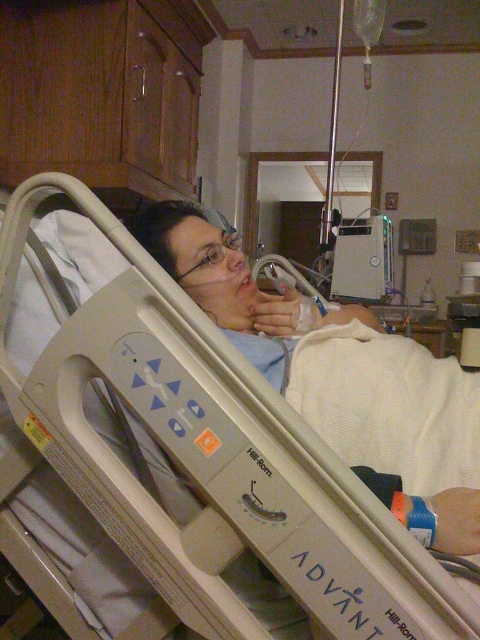
You are a nurse entering the hospital room and need to locate the metallic silver air purifier at upper center. According to the room layout, where should you look?

The metallic silver air purifier at upper center is located at point (362, 260) in the room layout.

You are a nurse entering the hospital room and need to adjust the oxygen mask on the clear plastic glasses at center. The beige plastic bed at center is in your way. Can you reach the glasses without moving the bed?

The beige plastic bed at center is closer to the viewer than the clear plastic glasses at center, so the bed is blocking your direct access to the glasses. You will need to move the bed to reach the glasses.